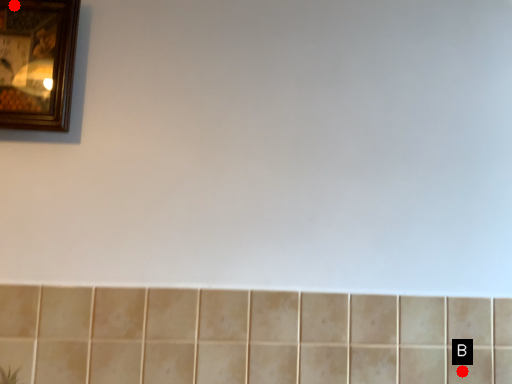
Question: Two points are circled on the image, labeled by A and B beside each circle. Which point is farther from the camera taking this photo?

Choices:
 (A) A is further
 (B) B is further

Answer: (B)